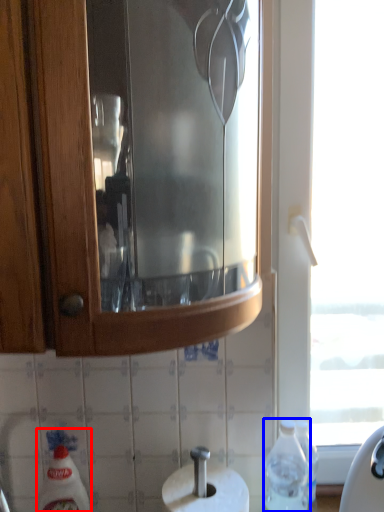
Question: Which object is further to the camera taking this photo, cleaning product (highlighted by a red box) or bottle (highlighted by a blue box)?

Choices:
 (A) cleaning product
 (B) bottle

Answer: (A)